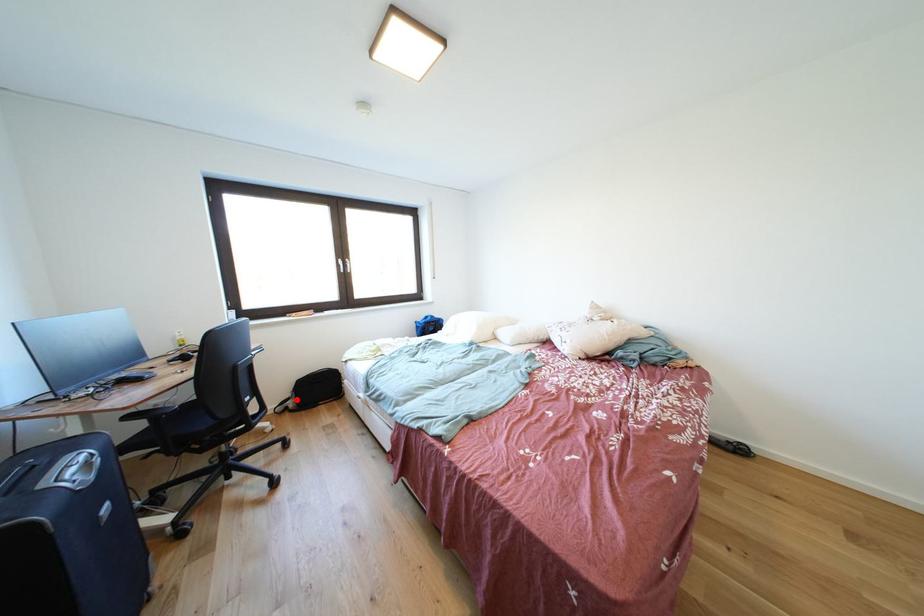
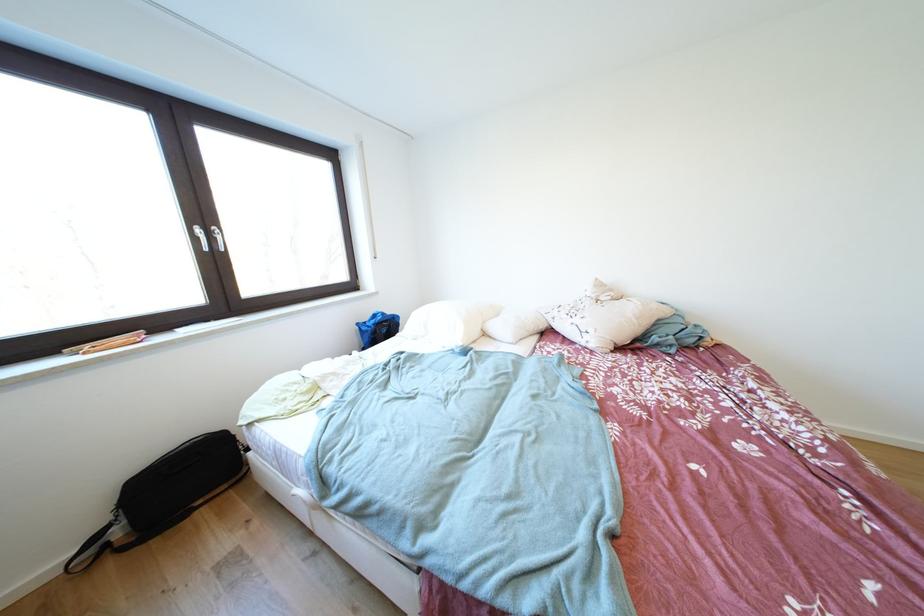
In the second image, find the point that corresponds to the highlighted location in the first image.

(114, 524)